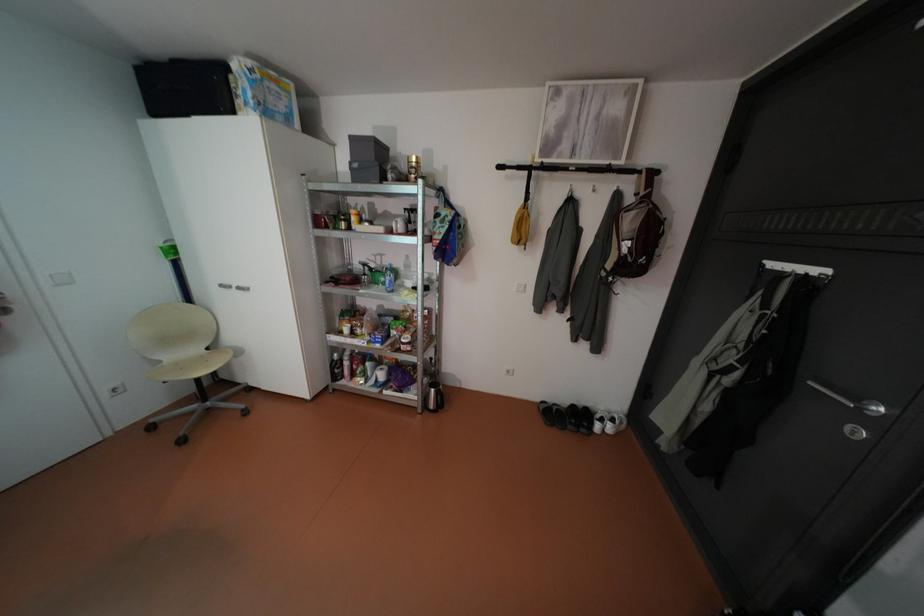
Image resolution: width=924 pixels, height=616 pixels. What do you see at coordinates (189, 363) in the screenshot?
I see `the chair sitting surface` at bounding box center [189, 363].